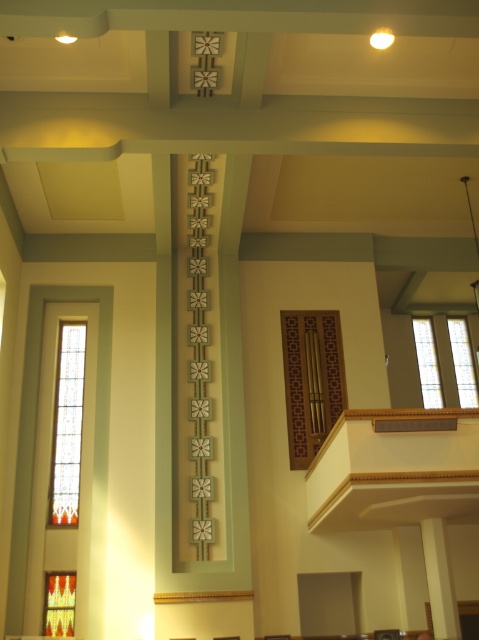
Question: Which is nearer to the stained glass window at left?

Choices:
 (A) stained glass at upper right
 (B) stained glass window at right
 (C) clear glass window at upper right

Answer: (C)

Question: In this image, where is stained glass window at left located relative to stained glass at upper right?

Choices:
 (A) right
 (B) left

Answer: (B)

Question: In this image, where is clear glass window at upper right located relative to stained glass window at right?

Choices:
 (A) right
 (B) left

Answer: (B)

Question: Which point is closer to the camera?

Choices:
 (A) stained glass window at right
 (B) clear glass window at upper right
 (C) stained glass at upper right

Answer: (C)

Question: Among these objects, which one is farthest from the camera?

Choices:
 (A) clear glass window at upper right
 (B) stained glass window at left

Answer: (A)

Question: Can you confirm if stained glass window at left is positioned to the left of stained glass window at right?

Choices:
 (A) yes
 (B) no

Answer: (A)